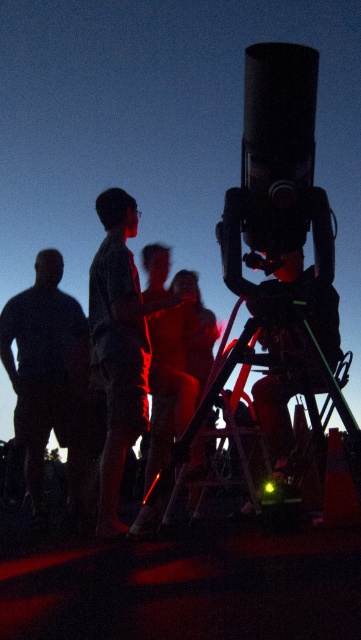
Is dark blue shirt at left below plaid shirt at center?

Indeed, dark blue shirt at left is positioned under plaid shirt at center.

Who is taller, dark blue shirt at left or plaid shirt at center?

plaid shirt at center is taller.

Between point (32, 387) and point (129, 236), which one is positioned in front?

Point (129, 236) is in front.

This screenshot has width=361, height=640. I want to click on dark blue shirt at left, so click(48, 378).

Can you confirm if plaid shirt at center is wider than metallic tripod at center?

Incorrect, plaid shirt at center's width does not surpass metallic tripod at center's.

Is plaid shirt at center bigger than metallic tripod at center?

No, plaid shirt at center is not bigger than metallic tripod at center.

Which is in front, point (102, 324) or point (298, 317)?

Point (298, 317) is in front.

Where is `plaid shirt at center`? This screenshot has width=361, height=640. plaid shirt at center is located at coordinates (119, 344).

Is point (23, 436) more distant than point (272, 305)?

Yes, point (23, 436) is farther from viewer.

Is dark blue shirt at left above metallic tripod at center?

Yes, dark blue shirt at left is above metallic tripod at center.

Who is more forward, (1, 355) or (190, 435)?

Point (190, 435) is in front.

Identify the location of dark blue shirt at left. (48, 378).